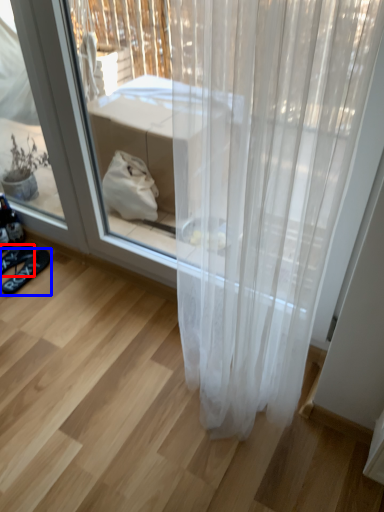
Question: Which point is closer to the camera, footwear (highlighted by a red box) or footwear (highlighted by a blue box)?

Choices:
 (A) footwear
 (B) footwear

Answer: (B)